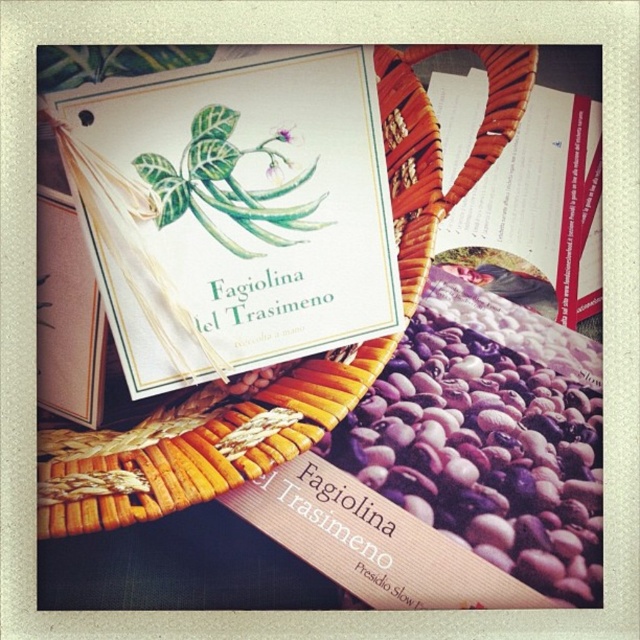
You are organizing items on a shelf and need to place the woven brown basket at center and the matte paper book at upper right. According to their positions in the image, which item should you place first to maintain the correct arrangement?

You should place the woven brown basket at center first because it is to the left of the matte paper book at upper right, so positioning the basket first ensures the book can be placed to its right accordingly.

You are organizing items on a shelf and have both the woven brown basket at center and the matte paper book at upper right. If you want to place them side by side without overlapping, which one should you place first to ensure they both fit?

The woven brown basket at center is wider than the matte paper book at upper right, so you should place the wider basket first to accommodate its size before placing the narrower book next to it.

You are a farmer who wants to place a new seed packet into the woven brown basket at center without disturbing the matte paper book at upper right. What is the minimum distance you need to move the basket to ensure the seed packet can be placed safely?

The woven brown basket at center and matte paper book at upper right are 7.56 inches apart. To place the seed packet safely without disturbing the book, you need to move the basket at least 7.56 inches away from the book.